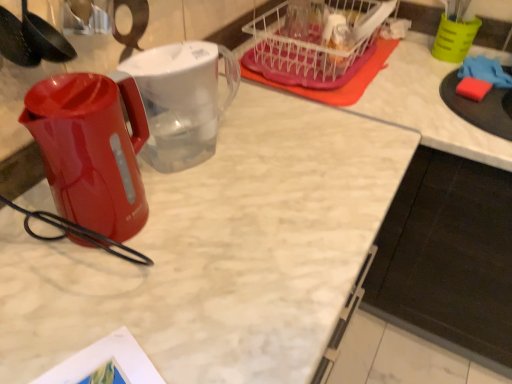
Locate an element on the screen. The width and height of the screenshot is (512, 384). transparent plastic pitcher at center is located at coordinates (182, 100).

This screenshot has height=384, width=512. Describe the element at coordinates (301, 54) in the screenshot. I see `translucent plastic basket at upper right` at that location.

This screenshot has height=384, width=512. Describe the element at coordinates (454, 39) in the screenshot. I see `green plastic cup at upper right` at that location.

Locate an element on the screen. This screenshot has width=512, height=384. transparent plastic pitcher at center is located at coordinates pyautogui.click(x=182, y=100).

Between transparent plastic pitcher at center and glossy plastic kettle at left, which one is positioned behind?

Positioned behind is transparent plastic pitcher at center.

Find the location of a particular element. pitcher located above the glossy plastic kettle at left (from the image's perspective) is located at coordinates (182, 100).

From a real-world perspective, is transparent plastic pitcher at center located beneath glossy plastic kettle at left?

Correct, in the physical world, transparent plastic pitcher at center is lower than glossy plastic kettle at left.

How many degrees apart are the facing directions of transparent plastic pitcher at center and glossy plastic kettle at left?

They differ by 53.8 degrees in their facing directions.

Consider the image. Looking at their sizes, would you say green plastic cup at upper right is wider or thinner than glossy plastic kettle at left?

Clearly, green plastic cup at upper right has less width compared to glossy plastic kettle at left.

In the scene shown: From the image's perspective, is green plastic cup at upper right on top of glossy plastic kettle at left?

Yes.

Does point (440, 41) appear closer or farther from the camera than point (87, 218)?

Point (440, 41) is farther from the camera than point (87, 218).

Considering the relative positions of black matte cabinet at lower right and green plastic cup at upper right in the image provided, is black matte cabinet at lower right to the left of green plastic cup at upper right from the viewer's perspective?

No, black matte cabinet at lower right is not to the left of green plastic cup at upper right.

Which of these two, black matte cabinet at lower right or green plastic cup at upper right, is bigger?

Bigger between the two is black matte cabinet at lower right.

Find the location of `coffee cup located on the left of black matte cabinet at lower right`. coffee cup located on the left of black matte cabinet at lower right is located at coordinates (454, 39).

Considering the sizes of objects black matte cabinet at lower right and green plastic cup at upper right in the image provided, who is thinner, black matte cabinet at lower right or green plastic cup at upper right?

With smaller width is green plastic cup at upper right.

Is transparent plastic pitcher at center directly adjacent to black matte cabinet at lower right?

No.

Consider the image. Is transparent plastic pitcher at center looking in the opposite direction of black matte cabinet at lower right?

That's not correct — transparent plastic pitcher at center is not looking away from black matte cabinet at lower right.

Between transparent plastic pitcher at center and black matte cabinet at lower right, which one appears on the right side from the viewer's perspective?

Positioned to the right is black matte cabinet at lower right.

Considering the sizes of objects transparent plastic pitcher at center and black matte cabinet at lower right in the image provided, who is taller, transparent plastic pitcher at center or black matte cabinet at lower right?

black matte cabinet at lower right is taller.

Is black matte cabinet at lower right not within glossy plastic kettle at left?

Yes.

Is black matte cabinet at lower right with glossy plastic kettle at left?

No, black matte cabinet at lower right is not beside glossy plastic kettle at left.

Visually, is black matte cabinet at lower right positioned to the left or to the right of glossy plastic kettle at left?

Clearly, black matte cabinet at lower right is on the right of glossy plastic kettle at left in the image.

Considering the sizes of objects black matte cabinet at lower right and glossy plastic kettle at left in the image provided, who is smaller, black matte cabinet at lower right or glossy plastic kettle at left?

With smaller size is glossy plastic kettle at left.

Is the surface of translucent plastic basket at upper right in direct contact with glossy plastic kettle at left?

No.

Is translucent plastic basket at upper right wider than glossy plastic kettle at left?

Correct, the width of translucent plastic basket at upper right exceeds that of glossy plastic kettle at left.

Who is smaller, translucent plastic basket at upper right or glossy plastic kettle at left?

Smaller between the two is glossy plastic kettle at left.

In the image, there is a glossy plastic kettle at left. At what (x,y) coordinates should I click in order to perform the action: click on basket below it (from a real-world perspective). Please return your answer as a coordinate pair (x, y). This screenshot has width=512, height=384. Looking at the image, I should click on (301, 54).

At what (x,y) coordinates should I click in order to perform the action: click on basket located underneath the black plastic spoon at upper left (from a real-world perspective). Please return your answer as a coordinate pair (x, y). The width and height of the screenshot is (512, 384). Looking at the image, I should click on (301, 54).

Are translucent plastic basket at upper right and black plastic spoon at upper left beside each other?

No, translucent plastic basket at upper right is not next to black plastic spoon at upper left.

Considering the relative sizes of translucent plastic basket at upper right and black plastic spoon at upper left in the image provided, is translucent plastic basket at upper right taller than black plastic spoon at upper left?

No, translucent plastic basket at upper right is not taller than black plastic spoon at upper left.

I want to click on pitcher that is on the right side of glossy plastic kettle at left, so click(x=182, y=100).

This screenshot has width=512, height=384. What are the coordinates of `coffee cup above the glossy plastic kettle at left (from the image's perspective)` in the screenshot? It's located at (454, 39).

Considering their positions, is transparent plastic pitcher at center positioned further to black matte cabinet at lower right than translucent plastic basket at upper right?

The object further to black matte cabinet at lower right is transparent plastic pitcher at center.

When comparing their distances from black plastic spoon at upper left, does transparent plastic pitcher at center or glossy plastic kettle at left seem further?

The object further to black plastic spoon at upper left is transparent plastic pitcher at center.

Based on their spatial positions, is glossy plastic kettle at left or translucent plastic basket at upper right closer to black plastic spoon at upper left?

The object closer to black plastic spoon at upper left is glossy plastic kettle at left.

Which object lies further to the anchor point glossy plastic kettle at left, green plastic cup at upper right or transparent plastic pitcher at center?

Based on the image, green plastic cup at upper right appears to be further to glossy plastic kettle at left.

Looking at this image, based on their spatial positions, is translucent plastic basket at upper right or transparent plastic pitcher at center closer to glossy plastic kettle at left?

The object closer to glossy plastic kettle at left is transparent plastic pitcher at center.

Based on their spatial positions, is translucent plastic basket at upper right or transparent plastic pitcher at center further from black matte cabinet at lower right?

The object further to black matte cabinet at lower right is transparent plastic pitcher at center.

Estimate the real-world distances between objects in this image. Which object is closer to green plastic cup at upper right, translucent plastic basket at upper right or black matte cabinet at lower right?

Based on the image, translucent plastic basket at upper right appears to be nearer to green plastic cup at upper right.

Estimate the real-world distances between objects in this image. Which object is further from transparent plastic pitcher at center, green plastic cup at upper right or glossy plastic kettle at left?

green plastic cup at upper right lies further to transparent plastic pitcher at center than the other object.

You are a GUI agent. You are given a task and a screenshot of the screen. Output one action in this format:
    pyautogui.click(x=<x>, y=<y>)
    Task: Click on the pitcher between glossy plastic kettle at left and green plastic cup at upper right
    
    Given the screenshot: What is the action you would take?
    pyautogui.click(x=182, y=100)

Locate an element on the screen. The height and width of the screenshot is (384, 512). pitcher between black plastic spoon at upper left and black matte cabinet at lower right is located at coordinates 182,100.

Where is `coffee cup between translucent plastic basket at upper right and black matte cabinet at lower right in the up-down direction`? Image resolution: width=512 pixels, height=384 pixels. coffee cup between translucent plastic basket at upper right and black matte cabinet at lower right in the up-down direction is located at coordinates (454, 39).

Where is `kettle positioned between black plastic spoon at upper left and transparent plastic pitcher at center from near to far`? The image size is (512, 384). kettle positioned between black plastic spoon at upper left and transparent plastic pitcher at center from near to far is located at coordinates (91, 150).